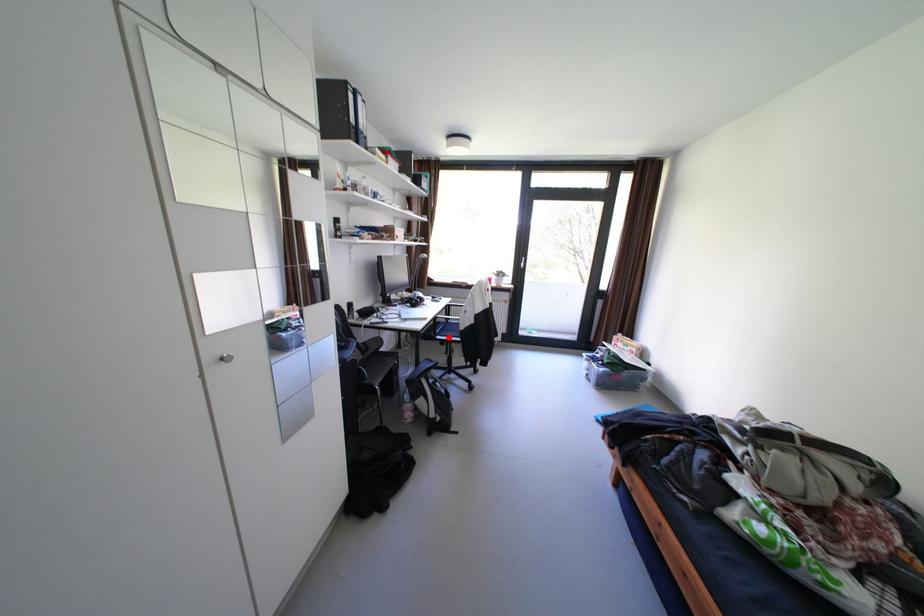
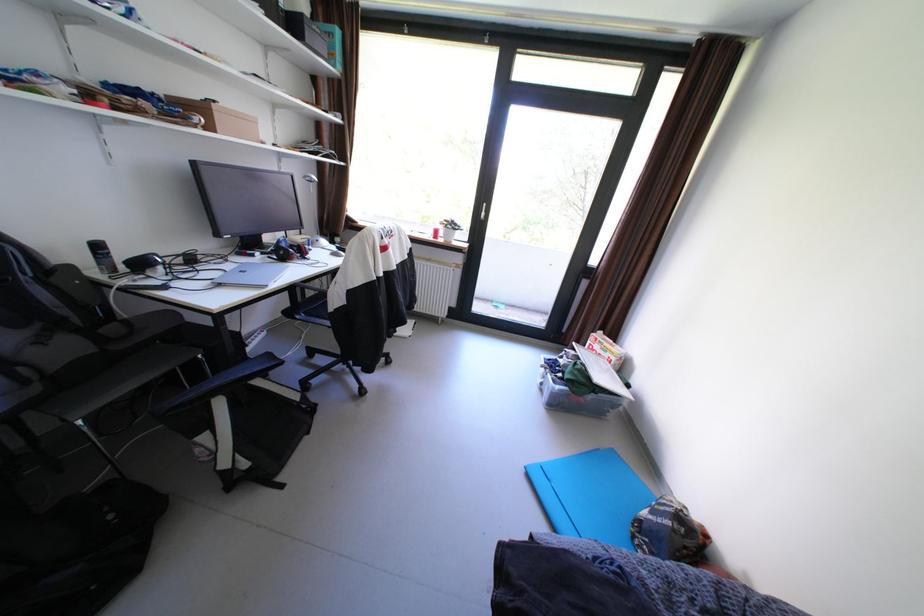
Question: I am providing you with two images of the same scene from different viewpoints. A red point is marked on the first image. At the location where the point appears in image 1, is it still visible in image 2?

Choices:
 (A) Yes
 (B) No

Answer: (A)